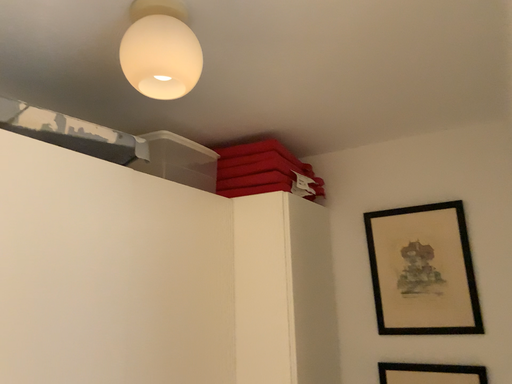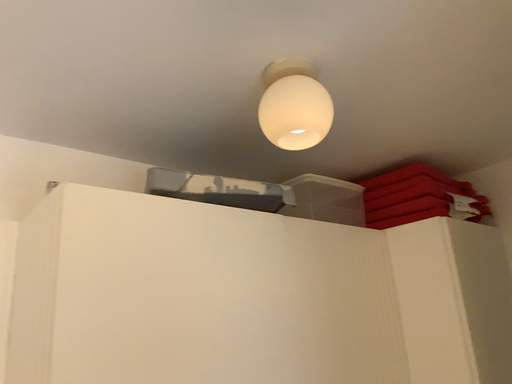
Question: Which way did the camera rotate in the video?

Choices:
 (A) rotated left
 (B) rotated right

Answer: (A)